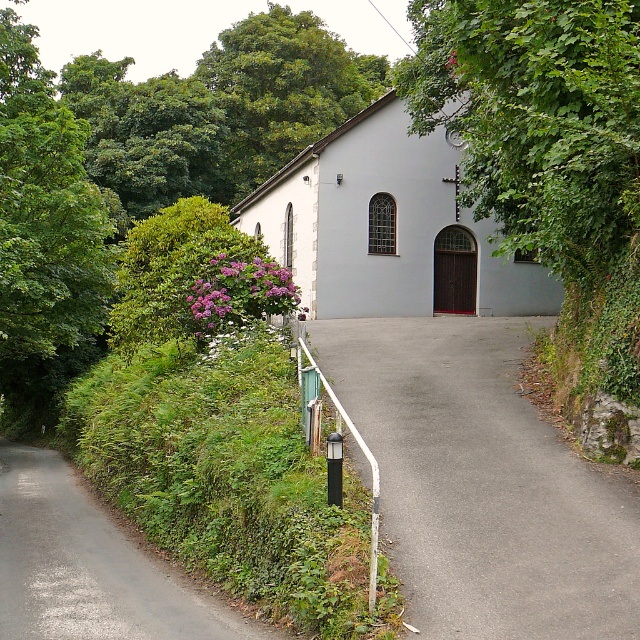
Question: Among these objects, which one is farthest from the camera?

Choices:
 (A) gray asphalt driveway at center
 (B) purple matte flowers at center-left
 (C) green leafy tree at center

Answer: (B)

Question: Can you confirm if gray asphalt driveway at center is positioned above green grassy driveway at lower left?

Choices:
 (A) yes
 (B) no

Answer: (A)

Question: Estimate the real-world distances between objects in this image. Which object is farther from the purple matte flowers at center-left?

Choices:
 (A) white smooth church at center
 (B) white metal rail at lower left
 (C) green leafy tree at center

Answer: (A)

Question: Estimate the real-world distances between objects in this image. Which object is closer to the white metal rail at lower left?

Choices:
 (A) green leafy tree at center
 (B) gray asphalt driveway at center
 (C) white smooth church at center
 (D) purple matte flowers at center-left

Answer: (B)

Question: Does white smooth church at center lie in front of white metal rail at lower left?

Choices:
 (A) no
 (B) yes

Answer: (A)

Question: Observing the image, what is the correct spatial positioning of green leafy tree at left in reference to white metal rail at lower left?

Choices:
 (A) above
 (B) below

Answer: (A)